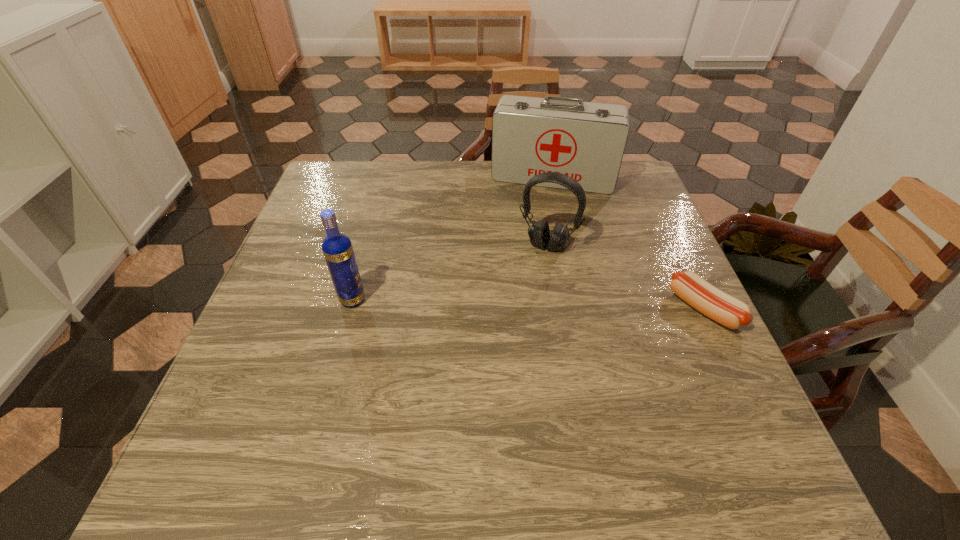
Where is `free region at the right edge of the desktop`? free region at the right edge of the desktop is located at coordinates (672, 292).

Identify the location of vacant space at the far left corner. This screenshot has height=540, width=960. (339, 174).

The height and width of the screenshot is (540, 960). In the image, there is a desktop. In order to click on vacant space at the near right corner in this screenshot , I will do pyautogui.click(x=676, y=386).

Find the location of a particular element. The width and height of the screenshot is (960, 540). empty space between the farthest object and the second farthest object is located at coordinates (550, 211).

This screenshot has width=960, height=540. I want to click on free space between the farthest object and the vodka, so click(453, 239).

I want to click on empty location between the vodka and the rightmost object, so click(x=528, y=304).

Where is `free space between the first-aid kit and the shortest object`? This screenshot has width=960, height=540. free space between the first-aid kit and the shortest object is located at coordinates (628, 243).

Identify the location of free space that is in between the headset and the rightmost object. The width and height of the screenshot is (960, 540). (626, 277).

Identify the location of unoccupied area between the farthest object and the vodka. (453, 239).

Image resolution: width=960 pixels, height=540 pixels. What are the coordinates of `free area in between the first-aid kit and the vodka` in the screenshot? It's located at 453,239.